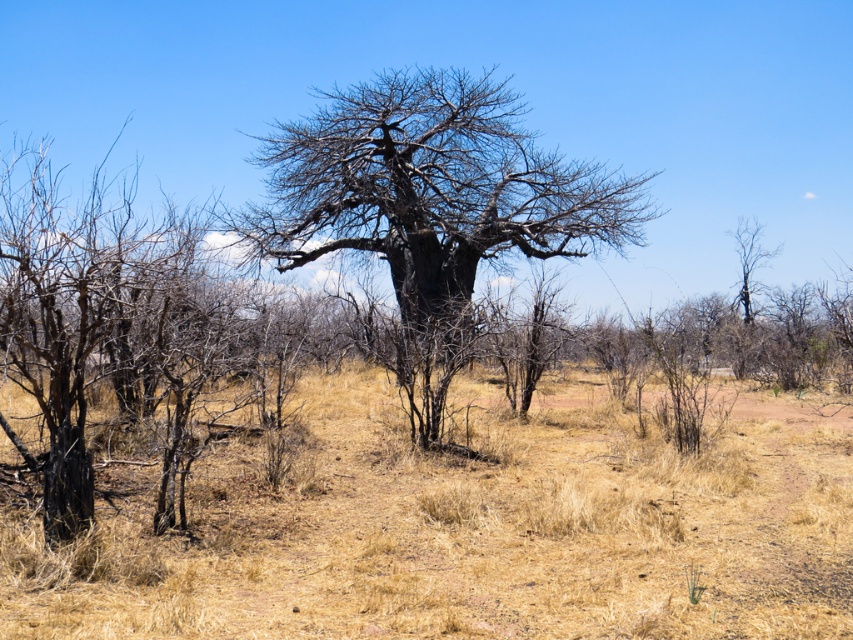
Does dry grass at center have a smaller size compared to bare wood tree at center?

Correct, dry grass at center occupies less space than bare wood tree at center.

The image size is (853, 640). I want to click on dry grass at center, so click(465, 528).

Does point (614, 420) lie in front of point (471, 333)?

No, (614, 420) is behind (471, 333).

You are a GUI agent. You are given a task and a screenshot of the screen. Output one action in this format:
    pyautogui.click(x=<x>, y=<y>)
    Task: Click on the dry grass at center
    
    Given the screenshot: What is the action you would take?
    pyautogui.click(x=465, y=528)